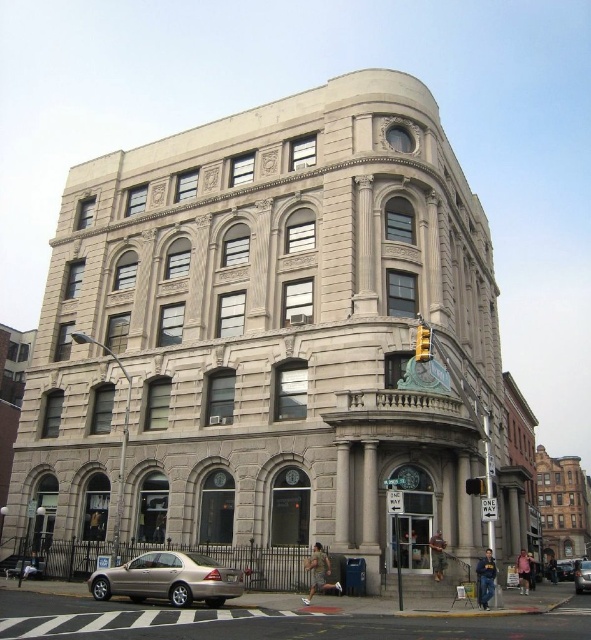
Question: Which object is closer to the camera taking this photo?

Choices:
 (A) gold metallic sedan at lower left
 (B) yellow plastic traffic light at upper center
 (C) gold metallic sedan at lower right
 (D) gold metallic car at center

Answer: (A)

Question: Does yellow plastic traffic light at upper center have a lesser width compared to yellow matte traffic light at upper center?

Choices:
 (A) yes
 (B) no

Answer: (A)

Question: Which object is positioned farthest from the gold metallic sedan at lower right?

Choices:
 (A) yellow matte traffic light at upper center
 (B) gold metallic car at center
 (C) gold metallic sedan at lower left

Answer: (C)

Question: Does gold metallic sedan at lower right appear under yellow matte traffic light at upper center?

Choices:
 (A) yes
 (B) no

Answer: (A)

Question: Can you confirm if yellow plastic traffic light at upper center is smaller than yellow matte traffic light at upper center?

Choices:
 (A) no
 (B) yes

Answer: (B)

Question: Which point is closer to the camera?

Choices:
 (A) yellow matte traffic light at upper center
 (B) gold metallic sedan at lower right
 (C) gold metallic car at center

Answer: (A)